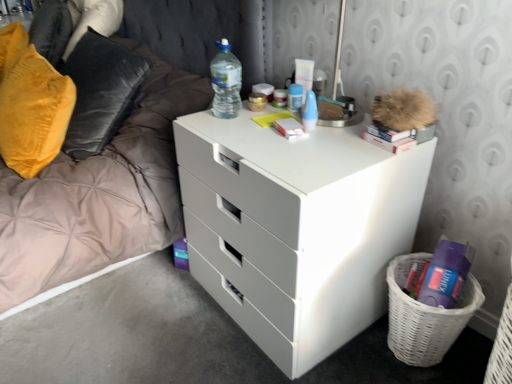
I want to click on unoccupied region to the right of translucent plastic water bottle at upper center, so click(274, 111).